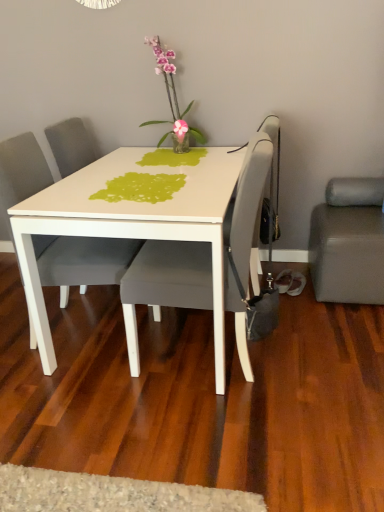
The image size is (384, 512). I want to click on free point in front of matte gray chair at center, the 2th chair in the left-to-right sequence, so click(x=205, y=436).